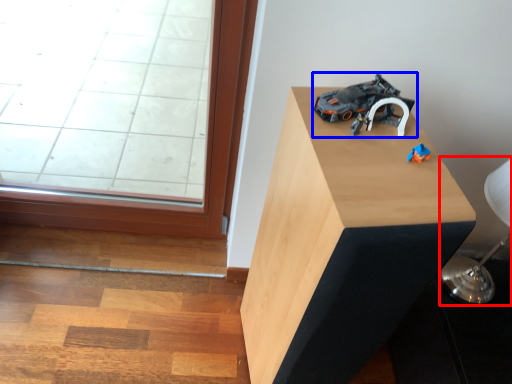
Question: Which of the following is the farthest to the observer, table lamp (highlighted by a red box) or toy (highlighted by a blue box)?

Choices:
 (A) table lamp
 (B) toy

Answer: (A)